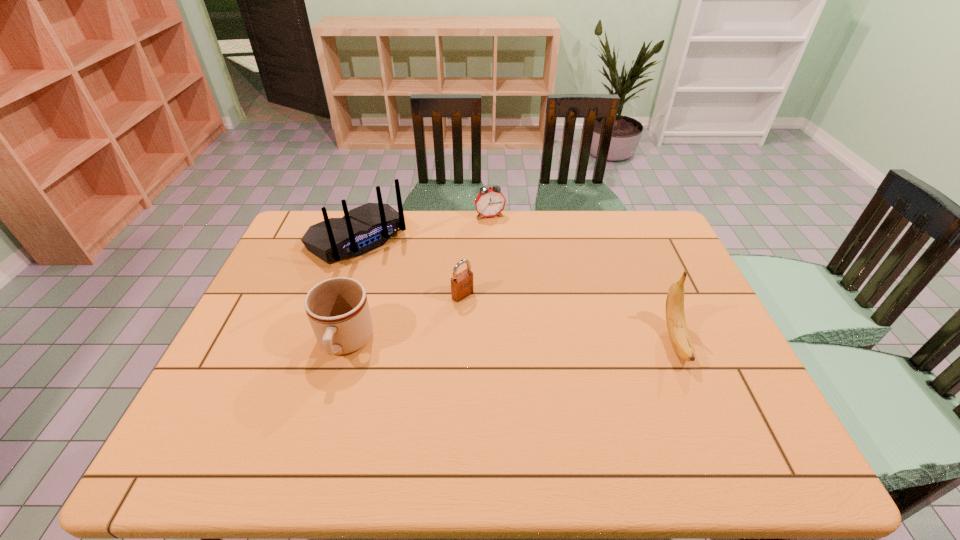
At what (x,y) coordinates should I click in order to perform the action: click on vacant space on the desktop that is between the mug and the second tallest object and is positioned on the front-facing side of the third nearest object. Please return your answer as a coordinate pair (x, y). The height and width of the screenshot is (540, 960). Looking at the image, I should click on (523, 342).

Where is `vacant spot on the desktop that is between the mug and the banana and is positioned on the clock face of the alarm clock`? vacant spot on the desktop that is between the mug and the banana and is positioned on the clock face of the alarm clock is located at coordinates (542, 342).

Find the location of a particular element. This screenshot has height=540, width=960. free space on the desktop that is between the mug and the banana and is positioned on the back of the router is located at coordinates (470, 342).